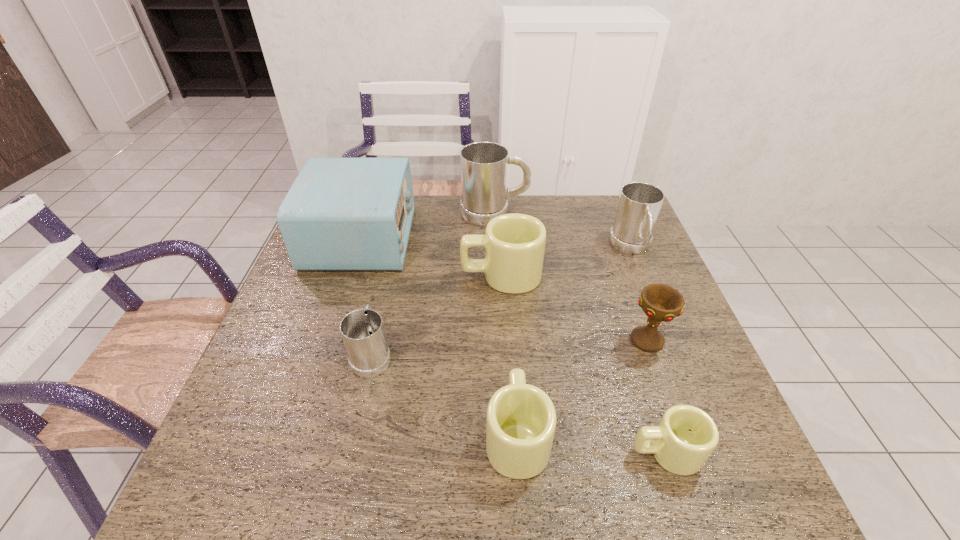
Where is `vacant region located on the side of the nearest gray mug with the handle`? Image resolution: width=960 pixels, height=540 pixels. vacant region located on the side of the nearest gray mug with the handle is located at coordinates (385, 301).

This screenshot has height=540, width=960. I want to click on free space located on the side of the nearest gray mug with the handle, so click(x=385, y=298).

The width and height of the screenshot is (960, 540). Identify the location of vacant region located with the handle on the side of the second smallest beige mug. (509, 309).

Identify the location of free spot located 0.390m with the handle on the side of the second smallest beige mug. This screenshot has width=960, height=540. (506, 275).

The width and height of the screenshot is (960, 540). Identify the location of free point located with the handle on the side of the second smallest beige mug. (508, 293).

Locate an element on the screen. The height and width of the screenshot is (540, 960). vacant space located with the handle on the side of the shortest object is located at coordinates (564, 452).

The width and height of the screenshot is (960, 540). What are the coordinates of `free location located 0.310m with the handle on the side of the shortest object` in the screenshot? It's located at tap(471, 452).

Where is `free region located 0.290m with the handle on the side of the shortest object`? The image size is (960, 540). free region located 0.290m with the handle on the side of the shortest object is located at coordinates (482, 452).

The height and width of the screenshot is (540, 960). Identify the location of radio receiver situated at the far edge. (340, 213).

In order to click on object that is at the left edge in this screenshot , I will do 340,213.